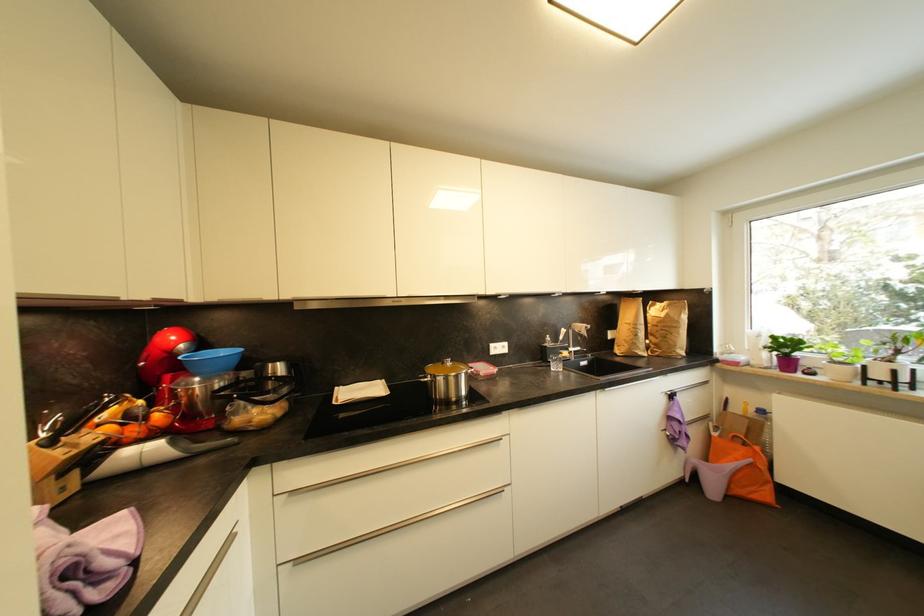
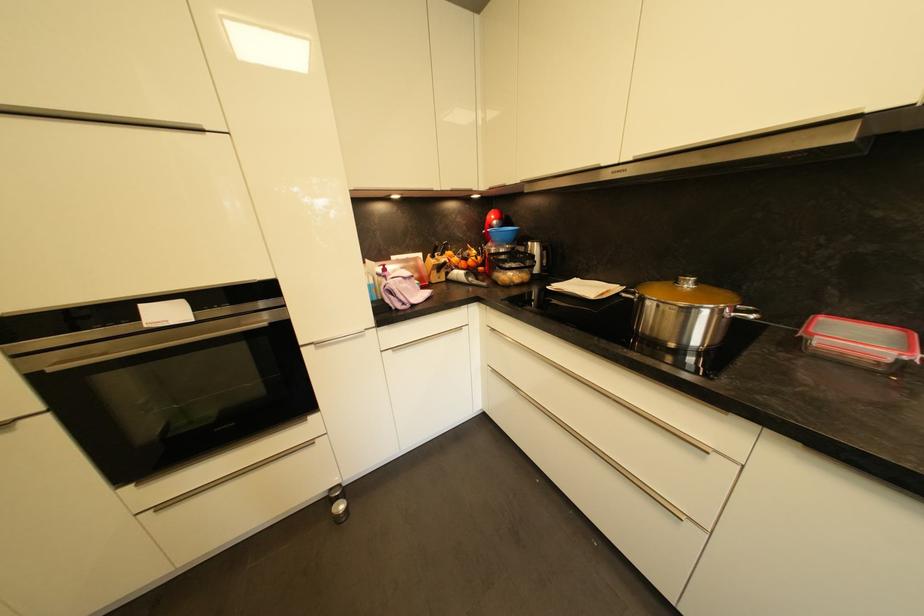
Find the pixel in the second image that matches point 454,365 in the first image.

(694, 286)